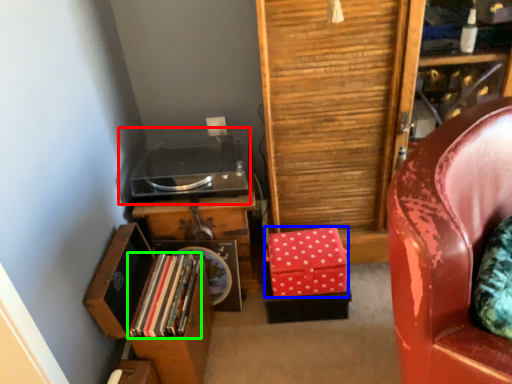
Question: Which object is the closest to the stereo (highlighted by a red box)? Choose among these: box (highlighted by a blue box) or book (highlighted by a green box).

Choices:
 (A) box
 (B) book

Answer: (B)